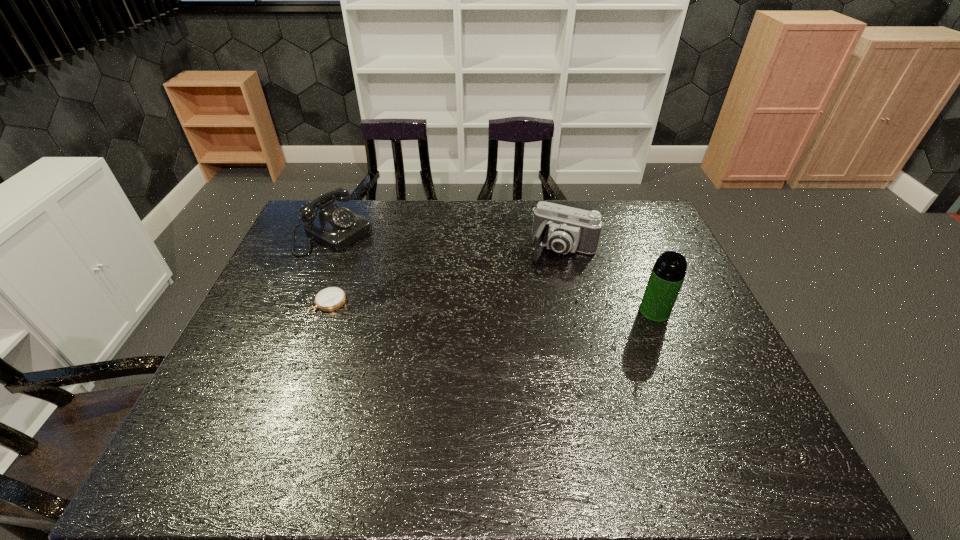
Locate an element on the screen. vacant space at the near edge of the desktop is located at coordinates (606, 391).

Where is `vacant region at the left edge`? The height and width of the screenshot is (540, 960). vacant region at the left edge is located at coordinates (275, 321).

Identify the location of free space at the right edge of the desktop. (636, 242).

I want to click on free space at the near left corner, so click(x=210, y=401).

Locate an element on the screen. Image resolution: width=960 pixels, height=540 pixels. free space at the far right corner of the desktop is located at coordinates (647, 204).

Where is `vacant area between the rightmost object and the telephone`? The image size is (960, 540). vacant area between the rightmost object and the telephone is located at coordinates (494, 273).

Where is `free space that is in between the shortest object and the camera`? The height and width of the screenshot is (540, 960). free space that is in between the shortest object and the camera is located at coordinates (446, 276).

The height and width of the screenshot is (540, 960). I want to click on empty space between the camera and the telephone, so click(449, 242).

At what (x,y) coordinates should I click in order to perform the action: click on free spot between the shortest object and the rightmost object. Please return your answer as a coordinate pair (x, y). The width and height of the screenshot is (960, 540). Looking at the image, I should click on (492, 307).

The height and width of the screenshot is (540, 960). Find the location of `free area in between the thermos bottle and the telephone`. free area in between the thermos bottle and the telephone is located at coordinates pyautogui.click(x=494, y=273).